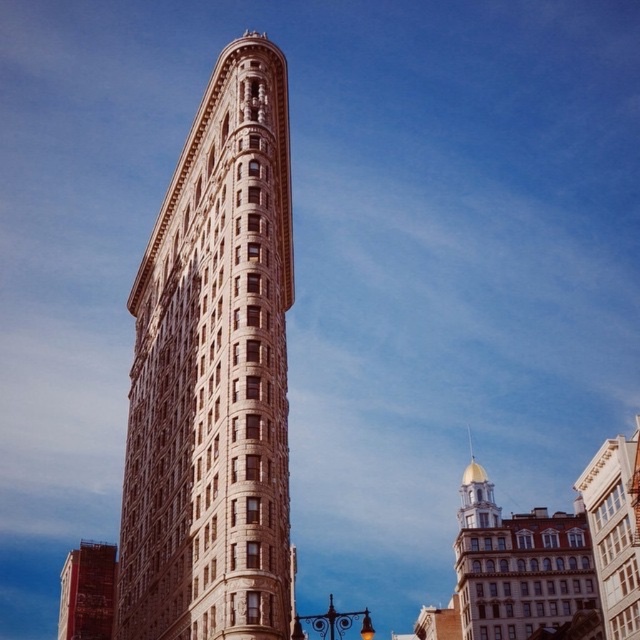
You are standing on the street looking at the beige stone building at center and the red brick building at lower left. Which building appears taller from your perspective?

The beige stone building at center appears taller than the red brick building at lower left because it has a greater height compared to the red brick building at lower left.